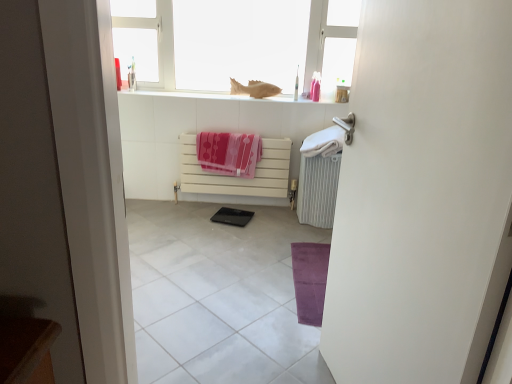
Question: Is white matte radiator at center not within black glossy pad at center?

Choices:
 (A) yes
 (B) no

Answer: (A)

Question: From the image's perspective, is white matte radiator at center under black glossy pad at center?

Choices:
 (A) yes
 (B) no

Answer: (B)

Question: Can you confirm if white matte radiator at center is thinner than black glossy pad at center?

Choices:
 (A) yes
 (B) no

Answer: (A)

Question: Does white matte radiator at center have a smaller size compared to black glossy pad at center?

Choices:
 (A) yes
 (B) no

Answer: (B)

Question: From a real-world perspective, is white matte radiator at center physically below black glossy pad at center?

Choices:
 (A) yes
 (B) no

Answer: (B)

Question: Considering the positions of purple velvety yoga mat at lower right and white soft towel at right, arranged as the second beach towel when viewed from the left, in the image, is purple velvety yoga mat at lower right wider or thinner than white soft towel at right, arranged as the second beach towel when viewed from the left,?

Choices:
 (A) wide
 (B) thin

Answer: (B)

Question: From the image's perspective, is purple velvety yoga mat at lower right positioned above or below white soft towel at right, the first beach towel viewed from the right?

Choices:
 (A) above
 (B) below

Answer: (B)

Question: From their relative heights in the image, would you say purple velvety yoga mat at lower right is taller or shorter than white soft towel at right, arranged as the second beach towel when viewed from the left?

Choices:
 (A) short
 (B) tall

Answer: (A)

Question: From a real-world perspective, is purple velvety yoga mat at lower right physically located above or below white soft towel at right, arranged as the second beach towel when viewed from the left?

Choices:
 (A) below
 (B) above

Answer: (A)

Question: Considering their positions, is white glossy window at upper center located in front of or behind white plastic toothbrush at upper center?

Choices:
 (A) front
 (B) behind

Answer: (A)

Question: From the image's perspective, relative to white plastic toothbrush at upper center, is white glossy window at upper center above or below?

Choices:
 (A) above
 (B) below

Answer: (A)

Question: Would you say white glossy window at upper center is inside or outside white plastic toothbrush at upper center?

Choices:
 (A) inside
 (B) outside

Answer: (B)

Question: Considering the positions of white glossy window at upper center and white plastic toothbrush at upper center in the image, is white glossy window at upper center taller or shorter than white plastic toothbrush at upper center?

Choices:
 (A) short
 (B) tall

Answer: (B)

Question: Is black glossy pad at center inside or outside of pink fabric beach towel at center, which is counted as the first beach towel, starting from the left?

Choices:
 (A) outside
 (B) inside

Answer: (A)

Question: Is point (223, 208) closer or farther from the camera than point (234, 142)?

Choices:
 (A) closer
 (B) farther

Answer: (B)